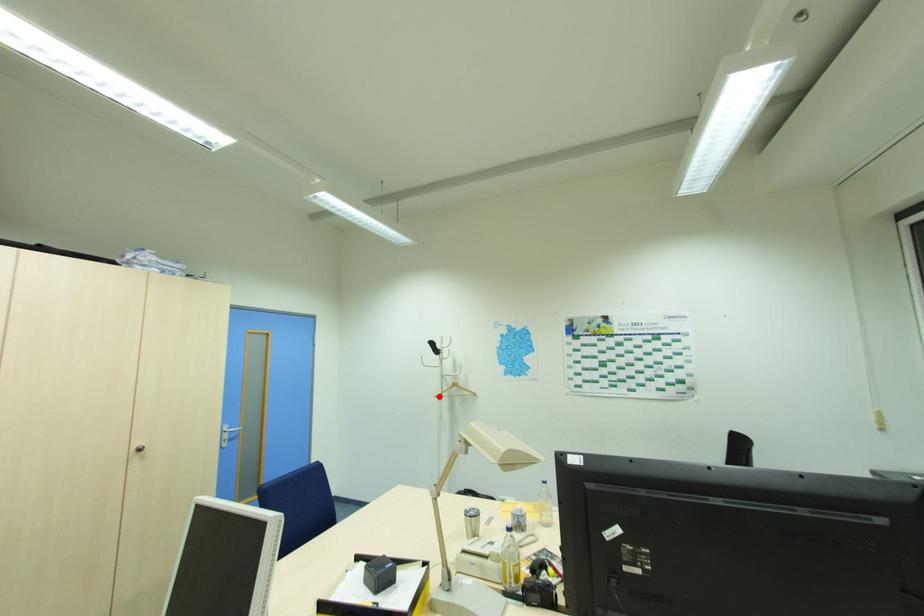
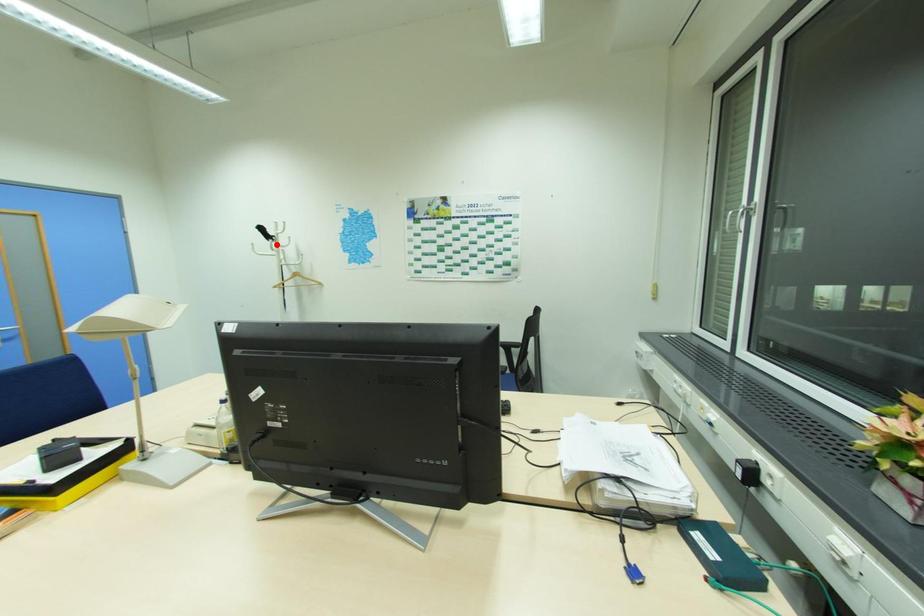
I am providing you with two images of the same scene from different viewpoints. A red point is marked on the first image and another point is marked on the second image. Is the red point in image1 aligned with the point shown in image2?

No